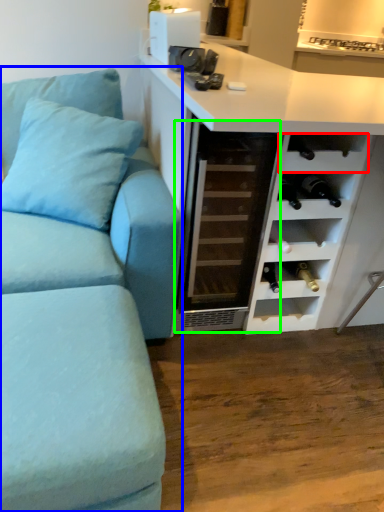
Question: Based on their relative distances, which object is nearer to shelf (highlighted by a red box)? Choose from studio couch (highlighted by a blue box) and glass door (highlighted by a green box).

Choices:
 (A) studio couch
 (B) glass door

Answer: (B)